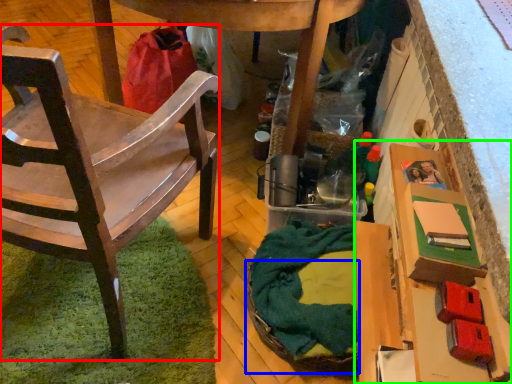
Question: Based on their relative distances, which object is farther from chair (highlighted by a red box)? Choose from basket (highlighted by a blue box) and cardboard box (highlighted by a green box).

Choices:
 (A) basket
 (B) cardboard box

Answer: (B)